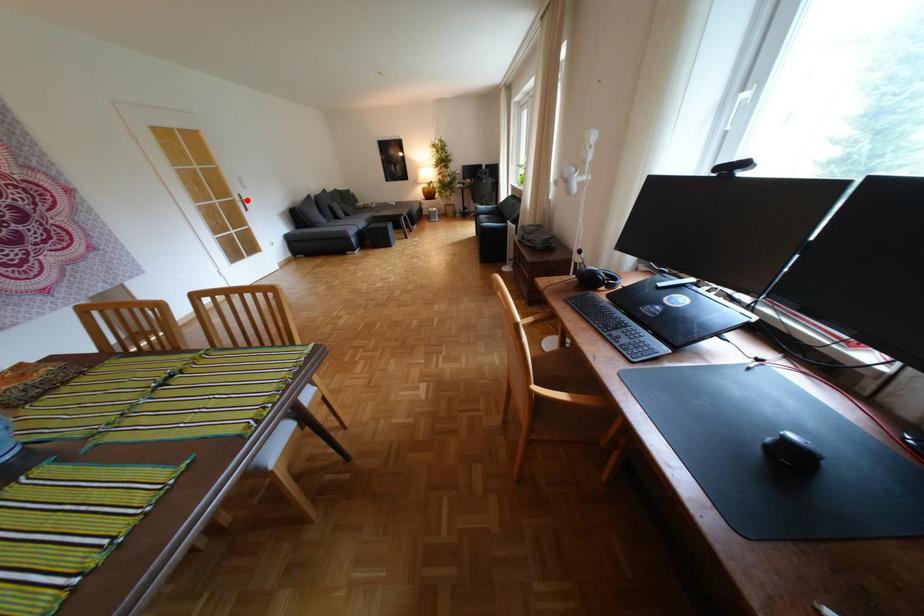
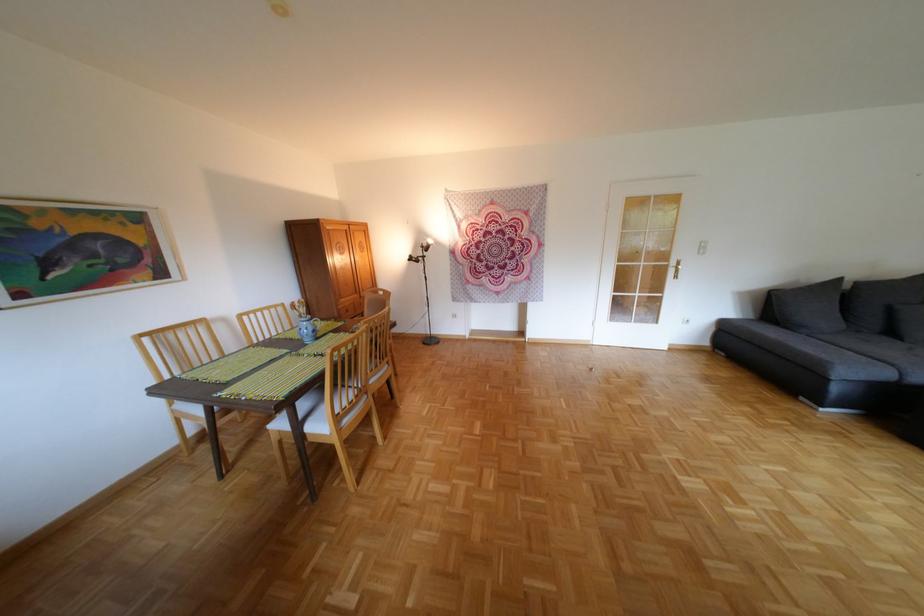
In the second image, find the point that corresponds to the highlighted location in the first image.

(679, 265)